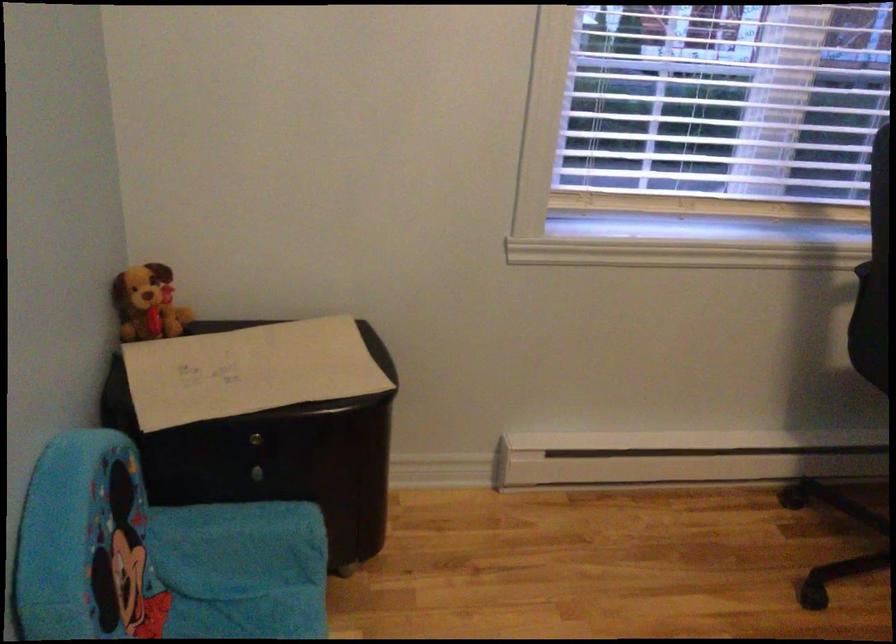
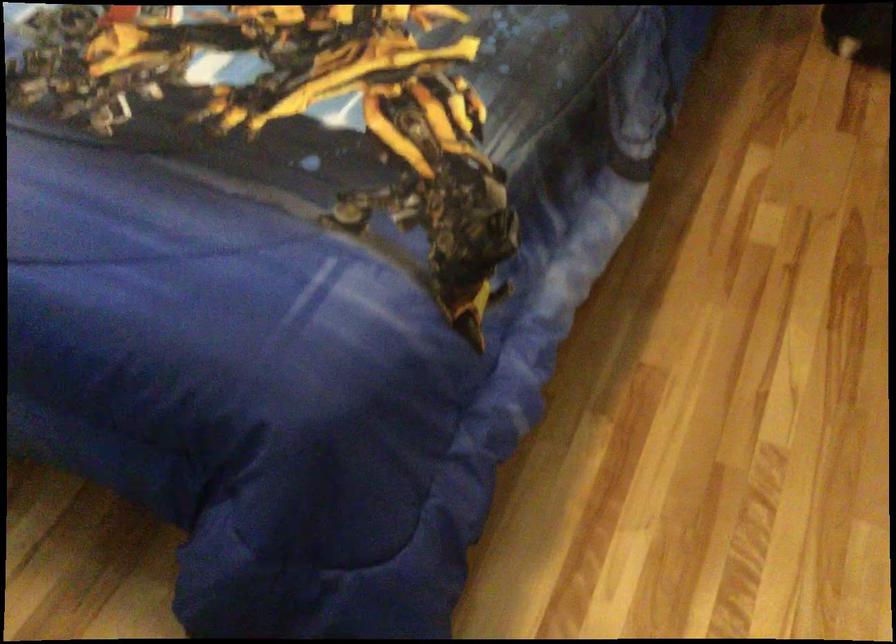
How did the camera likely rotate?

The camera rotated toward right-down.